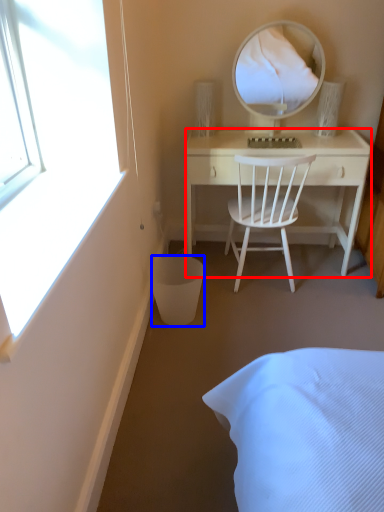
Question: Which object appears farthest to the camera in this image, desk (highlighted by a red box) or trash bin/can (highlighted by a blue box)?

Choices:
 (A) desk
 (B) trash bin/can

Answer: (A)